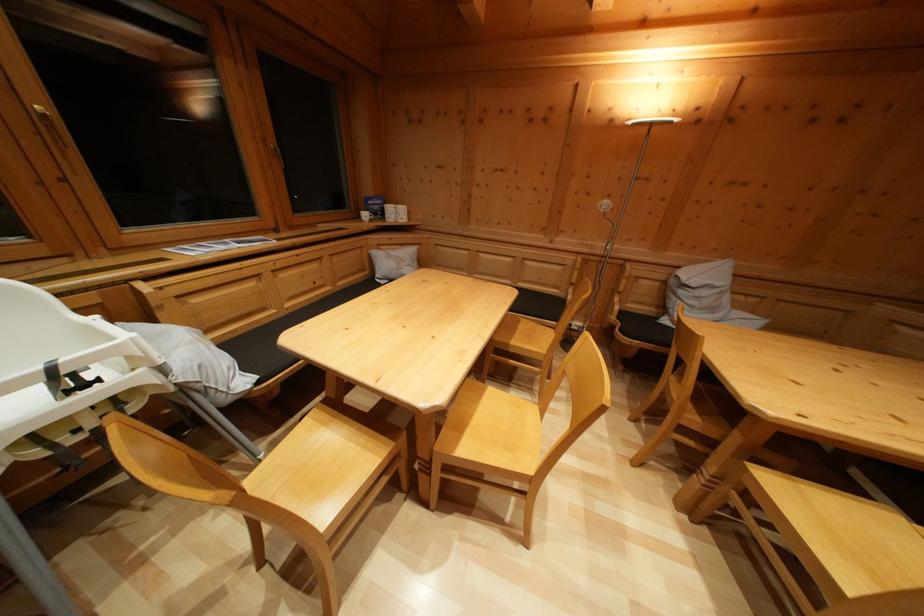
Find where to lift the white mug. Please return your answer as a coordinate pair (x, y).

(363, 215)